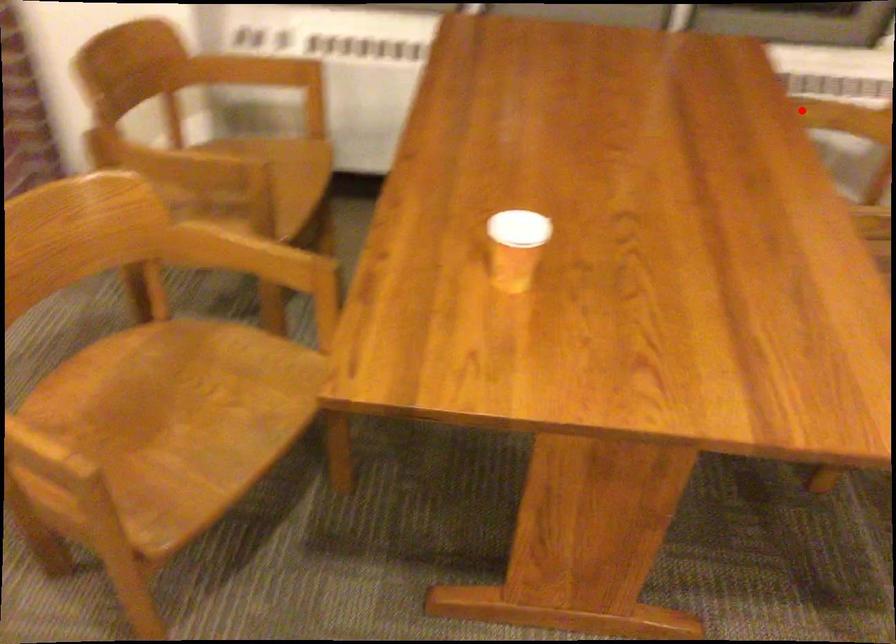
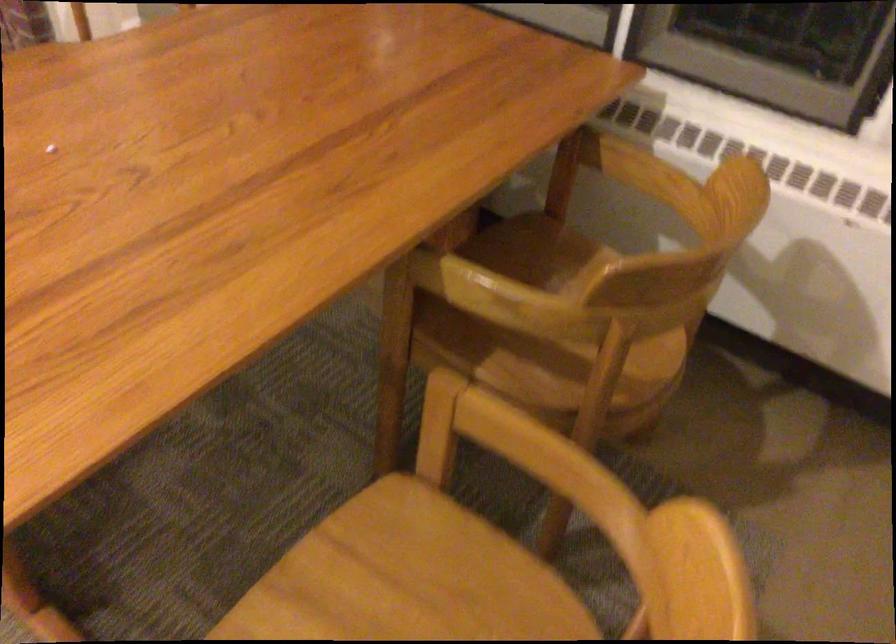
The point at the highlighted location is marked in the first image. Where is the corresponding point in the second image?

(621, 167)